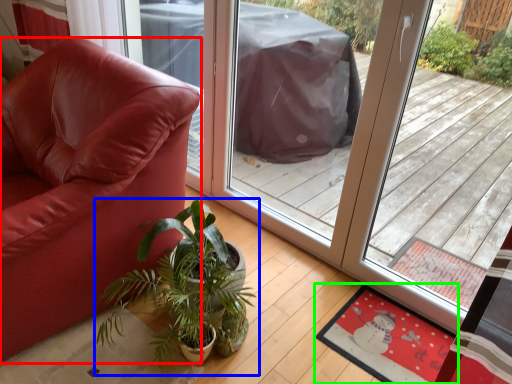
Question: Estimate the real-world distances between objects in this image. Which object is farther from chair (highlighted by a red box), houseplant (highlighted by a blue box) or mat (highlighted by a green box)?

Choices:
 (A) houseplant
 (B) mat

Answer: (B)